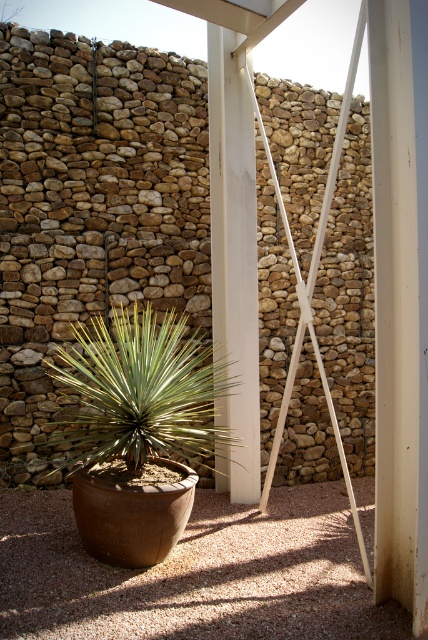
How much distance is there between white smooth pillar at right and green leafy plant at center?

white smooth pillar at right is 2.05 meters away from green leafy plant at center.

Does point (410, 538) come closer to viewer compared to point (59, 420)?

Yes, point (410, 538) is in front of point (59, 420).

Identify the location of white smooth pillar at right. The image size is (428, 640). (400, 298).

Which is above, green leafy plant at center or white smooth pillar at center?

white smooth pillar at center is higher up.

Who is more distant from viewer, [187,356] or [250,218]?

Positioned behind is point [187,356].

In order to click on green leafy plant at center in this screenshot , I will do `click(139, 390)`.

Who is more distant from viewer, (199, 576) or (104, 388)?

Point (104, 388)

Between brown gravel at lower center and green leafy plant at center, which one is positioned higher?

green leafy plant at center is above.

Between point (64, 509) and point (157, 362), which one is positioned behind?

Positioned behind is point (64, 509).

You are a GUI agent. You are given a task and a screenshot of the screen. Output one action in this format:
    pyautogui.click(x=<x>, y=<y>)
    Task: Click on the brown gravel at lower center
    The height and width of the screenshot is (640, 428).
    Given the screenshot: What is the action you would take?
    pyautogui.click(x=195, y=573)